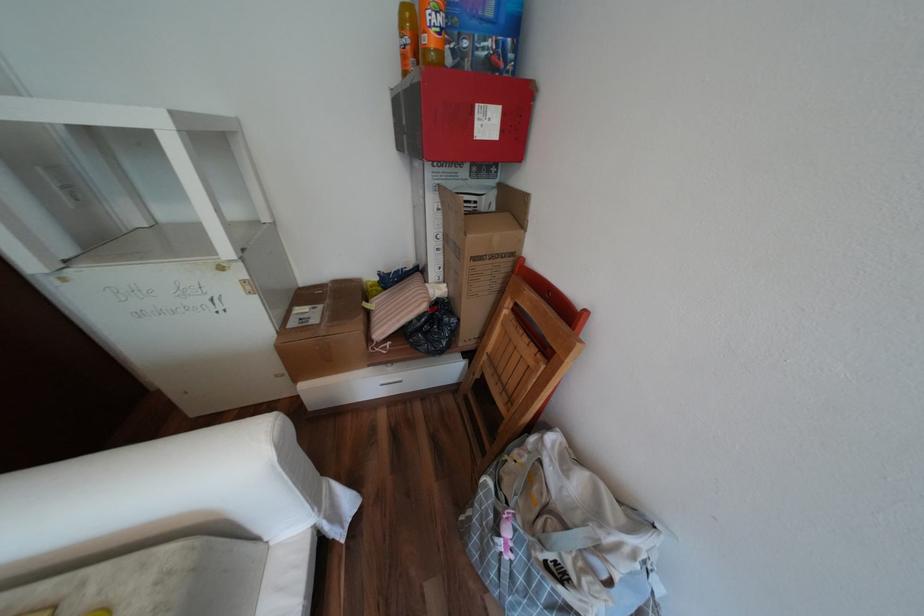
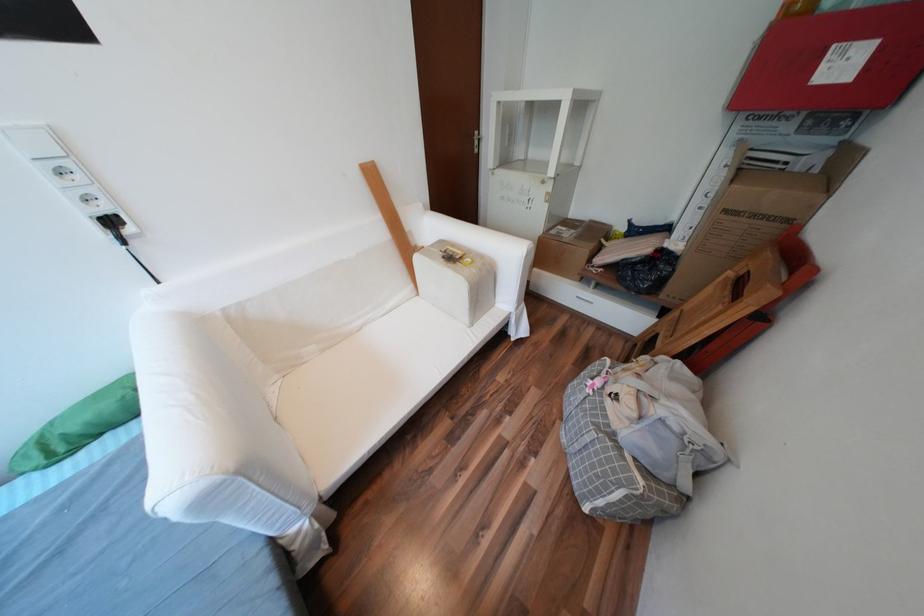
Locate, in the second image, the point that corresponds to (496,515) in the first image.

(602, 371)